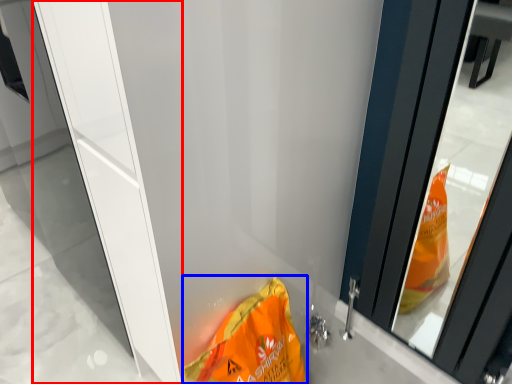
Question: Among these objects, which one is farthest to the camera, screen door (highlighted by a red box) or waste (highlighted by a blue box)?

Choices:
 (A) screen door
 (B) waste

Answer: (B)